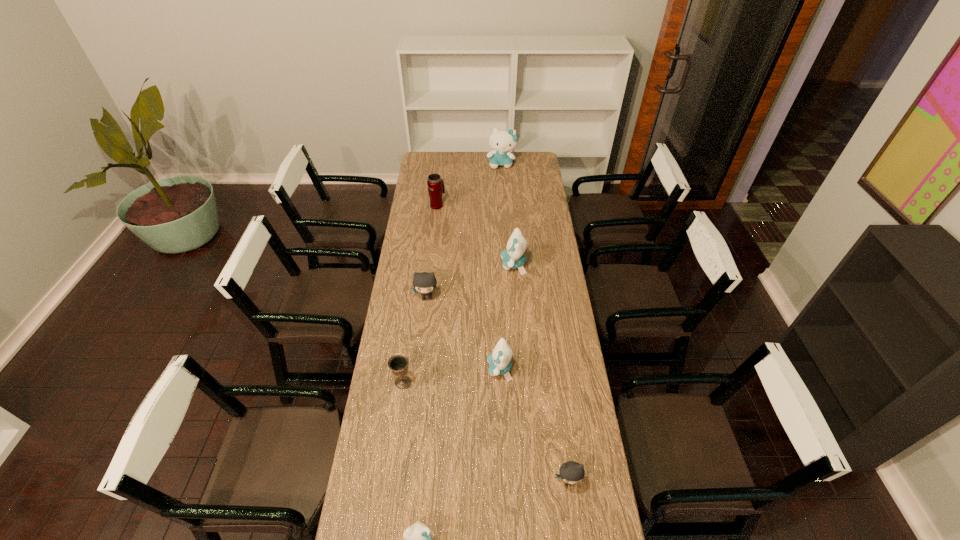
Locate an element on the screen. This screenshot has width=960, height=540. object that is the seventh closest to the seventh nearest object is located at coordinates coord(418,537).

Identify the location of object that is the second closest one to the left gray kitten. Image resolution: width=960 pixels, height=540 pixels. (499, 361).

Point out which kitten is positioned as the second nearest to the leftmost blue kitten. Please provide its 2D coordinates. Your answer should be formatted as a tuple, i.e. [(x, y)], where the tuple contains the x and y coordinates of a point satisfying the conditions above.

[(499, 361)]

Select which kitten is the fourth closest to the left gray kitten. Please provide its 2D coordinates. Your answer should be formatted as a tuple, i.e. [(x, y)], where the tuple contains the x and y coordinates of a point satisfying the conditions above.

[(418, 537)]

Image resolution: width=960 pixels, height=540 pixels. In order to click on blue kitten object that ranks as the third closest to the bronze chalice in this screenshot , I will do (x=514, y=257).

Locate an element on the screen. This screenshot has height=540, width=960. blue kitten that stands as the second closest to the chalice is located at coordinates (418, 537).